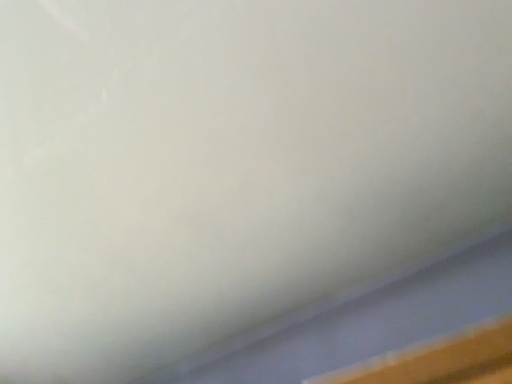
In order to face brown matte plywood at lower right, should I rotate leftwards or rightwards?

A 22.879 degree turn to the right will do.

Image resolution: width=512 pixels, height=384 pixels. What do you see at coordinates (440, 360) in the screenshot?
I see `brown matte plywood at lower right` at bounding box center [440, 360].

You are a GUI agent. You are given a task and a screenshot of the screen. Output one action in this format:
    pyautogui.click(x=<x>, y=<y>)
    Task: Click on the brown matte plywood at lower right
    
    Given the screenshot: What is the action you would take?
    pyautogui.click(x=440, y=360)

Measure the distance between brown matte plywood at lower right and camera.

brown matte plywood at lower right is 27.68 inches away from camera.

Find the location of a particular element. brown matte plywood at lower right is located at coordinates (440, 360).